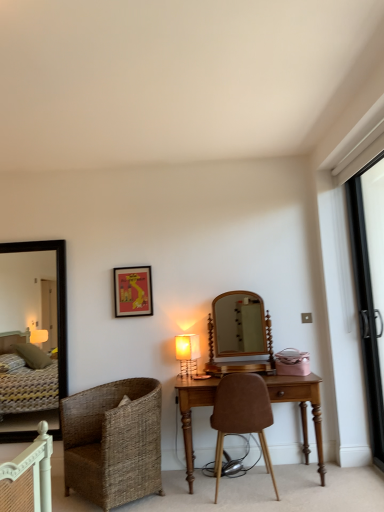
Question: Can you confirm if wooden desk at center is wider than brown leather chair at center, arranged as the second chair when viewed from the left?

Choices:
 (A) yes
 (B) no

Answer: (B)

Question: Is wooden desk at center outside brown leather chair at center, positioned as the first chair in right-to-left order?

Choices:
 (A) yes
 (B) no

Answer: (A)

Question: Can you confirm if wooden desk at center is taller than brown leather chair at center, positioned as the first chair in right-to-left order?

Choices:
 (A) no
 (B) yes

Answer: (A)

Question: Is wooden desk at center facing towards brown leather chair at center, positioned as the first chair in right-to-left order?

Choices:
 (A) yes
 (B) no

Answer: (A)

Question: Is brown leather chair at center, arranged as the second chair when viewed from the left, surrounded by wooden desk at center?

Choices:
 (A) yes
 (B) no

Answer: (A)

Question: Is wooden desk at center behind brown leather chair at center, positioned as the first chair in right-to-left order?

Choices:
 (A) no
 (B) yes

Answer: (B)

Question: Is black wooden mirror at left looking in the opposite direction of wooden desk at center?

Choices:
 (A) no
 (B) yes

Answer: (A)

Question: Can you confirm if black wooden mirror at left is shorter than wooden desk at center?

Choices:
 (A) no
 (B) yes

Answer: (A)

Question: Is black wooden mirror at left completely or partially outside of wooden desk at center?

Choices:
 (A) yes
 (B) no

Answer: (A)

Question: Can you confirm if black wooden mirror at left is thinner than wooden desk at center?

Choices:
 (A) no
 (B) yes

Answer: (B)

Question: Does black wooden mirror at left turn towards wooden desk at center?

Choices:
 (A) no
 (B) yes

Answer: (A)

Question: From the image's perspective, is black wooden mirror at left on wooden desk at center?

Choices:
 (A) yes
 (B) no

Answer: (A)

Question: Is brown leather chair at center, arranged as the second chair when viewed from the left, oriented towards metallic gold table lamp at center?

Choices:
 (A) no
 (B) yes

Answer: (A)